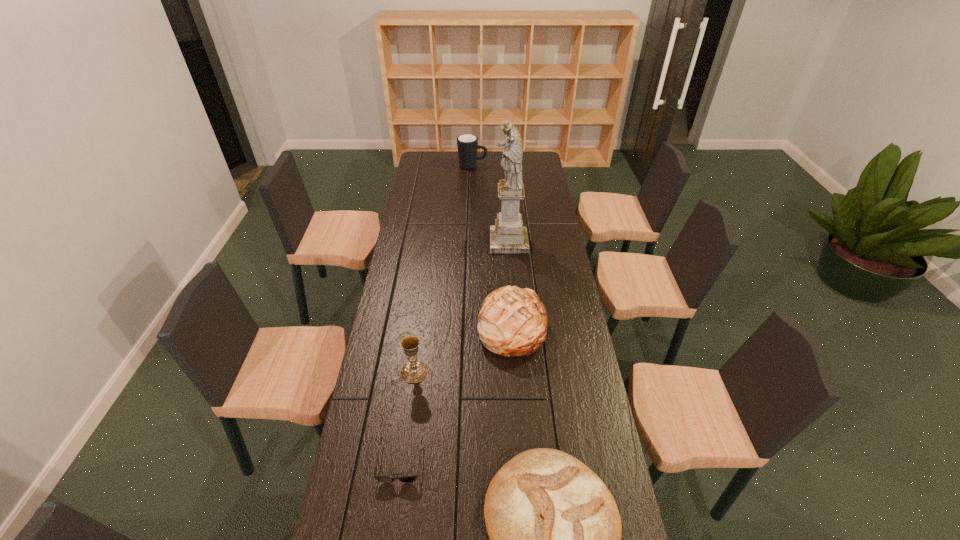
At what (x,y) coordinates should I click in order to perform the action: click on free location that satisfies the following two spatial constraints: 1. on the front-facing side of the tallest object; 2. on the front lenses of the shortest object. Please return your answer as a coordinate pair (x, y). This screenshot has height=540, width=960. Looking at the image, I should click on (526, 461).

This screenshot has width=960, height=540. What are the coordinates of `vacant space that satisfies the following two spatial constraints: 1. on the back side of the taller bread; 2. on the side of the farthest object with the handle` in the screenshot? It's located at (500, 166).